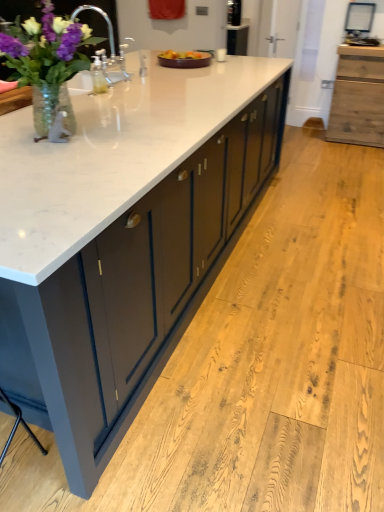
I want to click on free space in front of clear glass vase at left, so click(x=61, y=170).